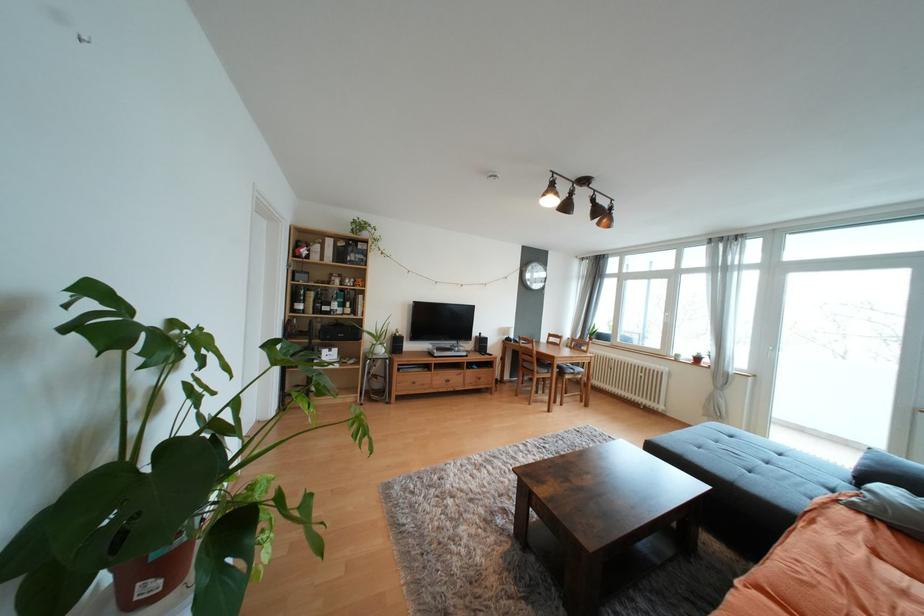
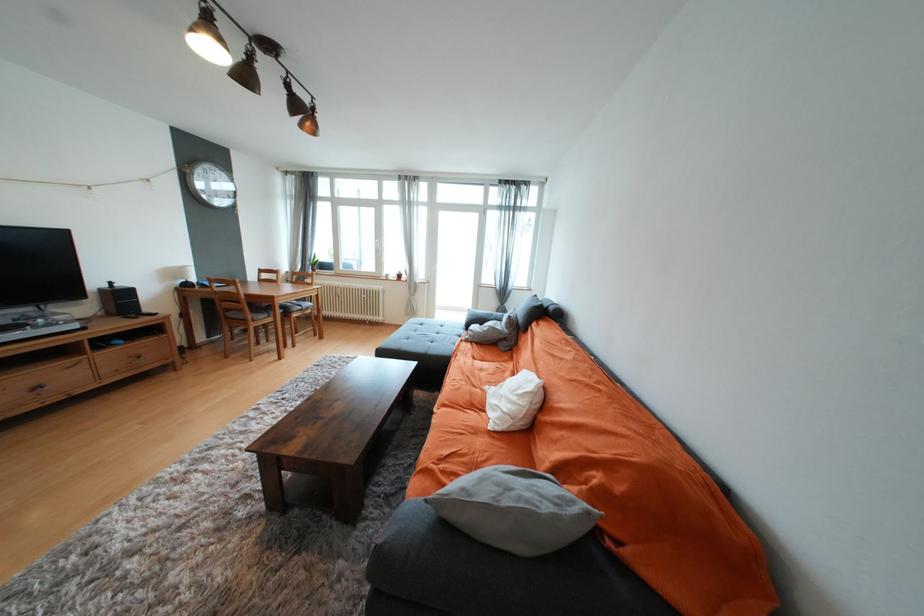
Find the pixel in the second image that matches point (883, 557) in the first image.

(480, 360)